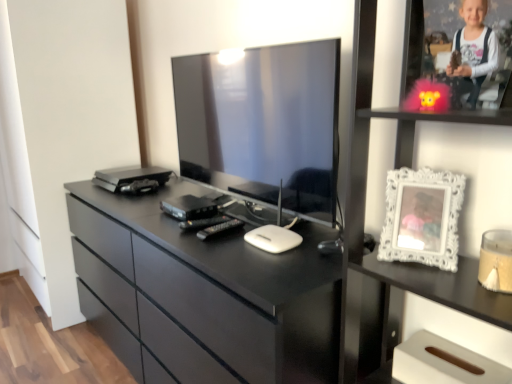
Question: Visually, is white ornate frame at right positioned to the left or to the right of white glossy picture frame at upper right?

Choices:
 (A) right
 (B) left

Answer: (B)

Question: From a real-world perspective, relative to white glossy picture frame at upper right, is white ornate frame at right vertically above or below?

Choices:
 (A) below
 (B) above

Answer: (B)

Question: Which of these objects is positioned farthest from the satin black television at center?

Choices:
 (A) white glossy frame at upper right
 (B) satin black device at center
 (C) white glossy picture frame at upper right
 (D) white ornate frame at right
 (E) black glossy chest of drawers at center

Answer: (D)

Question: Based on their relative distances, which object is farther from the black glossy chest of drawers at center?

Choices:
 (A) white ornate frame at right
 (B) white glossy picture frame at upper right
 (C) satin black television at center
 (D) white glossy frame at upper right
 (E) satin black device at center

Answer: (D)